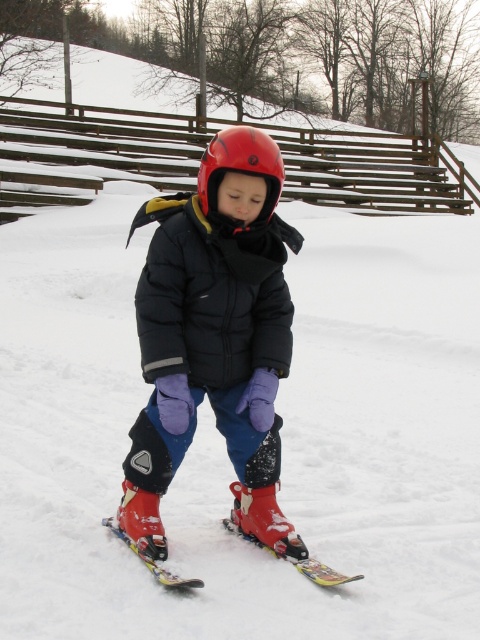
Question: Is shiny red helmet at center smaller than red matte ski at lower center?

Choices:
 (A) yes
 (B) no

Answer: (B)

Question: Which point is closer to the camera?

Choices:
 (A) (217, 147)
 (B) (202, 248)

Answer: (A)

Question: Among these objects, which one is farthest from the camera?

Choices:
 (A) matte black jacket at center
 (B) red matte ski at lower center

Answer: (B)

Question: Among these objects, which one is farthest from the camera?

Choices:
 (A) shiny red helmet at center
 (B) shiny metallic skis at lower center
 (C) red matte ski at lower center

Answer: (B)

Question: Is shiny metallic skis at lower center further to the viewer compared to yellow plastic ski at center?

Choices:
 (A) no
 (B) yes

Answer: (A)

Question: Does matte black jacket at center have a lesser width compared to red matte ski at lower center?

Choices:
 (A) no
 (B) yes

Answer: (A)